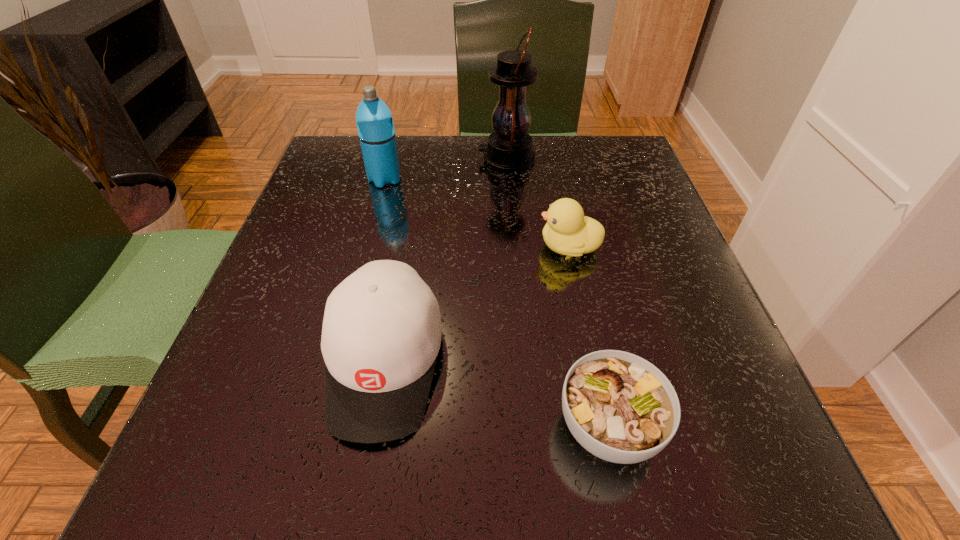
What are the coordinates of `blank area in the image that satisfies the following two spatial constraints: 1. above the soup bowl, indicating its light source; 2. on the right side of the lantern` in the screenshot? It's located at (528, 427).

Locate an element on the screen. This screenshot has width=960, height=540. free location that satisfies the following two spatial constraints: 1. at the beak of the duckling; 2. on the front-facing side of the baseball cap is located at coordinates (593, 362).